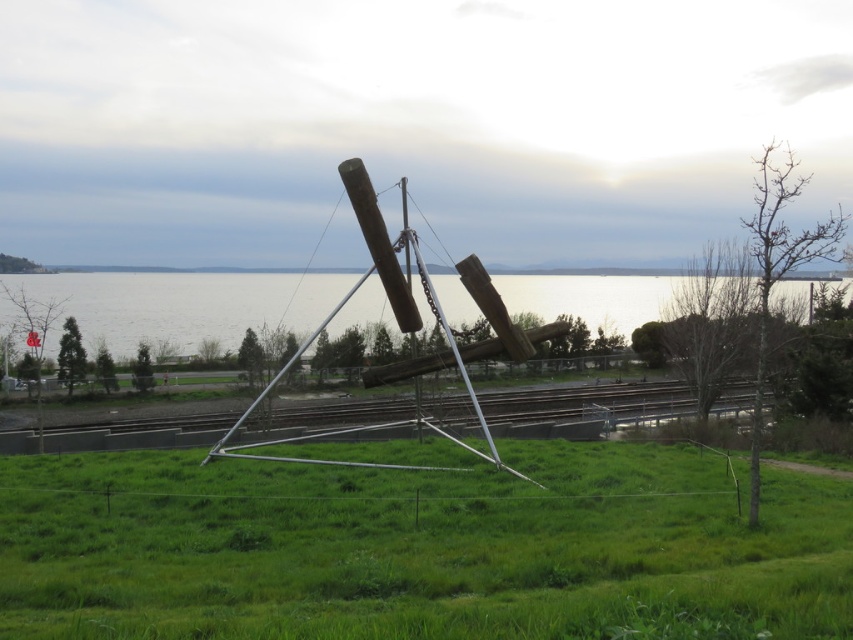
You are standing at the dirt path leading to the installation and want to take a photo of both point (x=831, y=499) and point (x=421, y=314). Which point will appear larger in your photo?

Point (x=831, y=499) is closer to the camera than point (x=421, y=314), so it will appear larger in the photo.

You are standing on the dirt path leading towards the installation and see the green grass at center and the transparent water at center. Which object is located to the right of the other?

The green grass at center is positioned on the right side of transparent water at center, so the green grass at center is to the right of the transparent water at center.